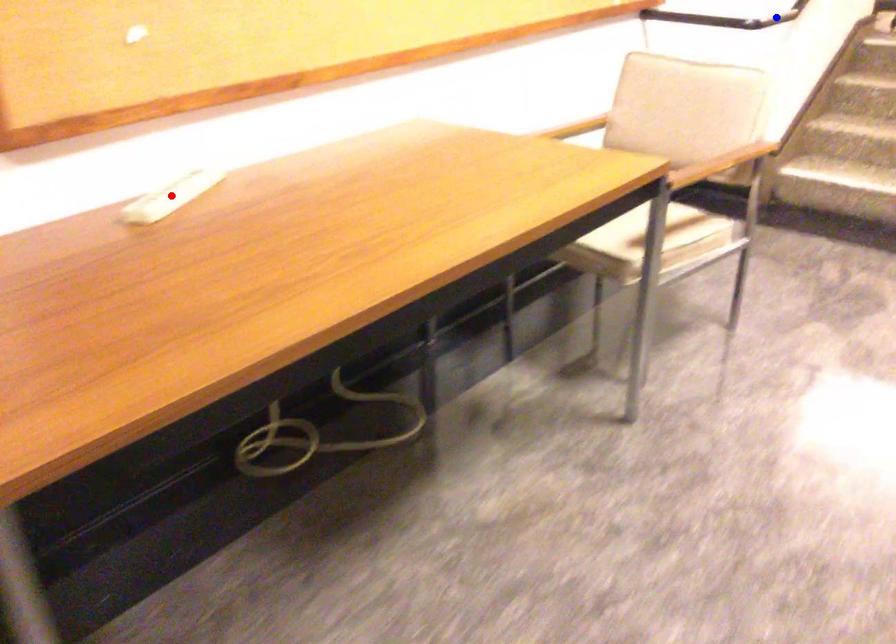
Question: In the image, two points are highlighted. Which point is nearer to the camera? Reply with the corresponding letter.

Choices:
 (A) blue point
 (B) red point

Answer: (B)